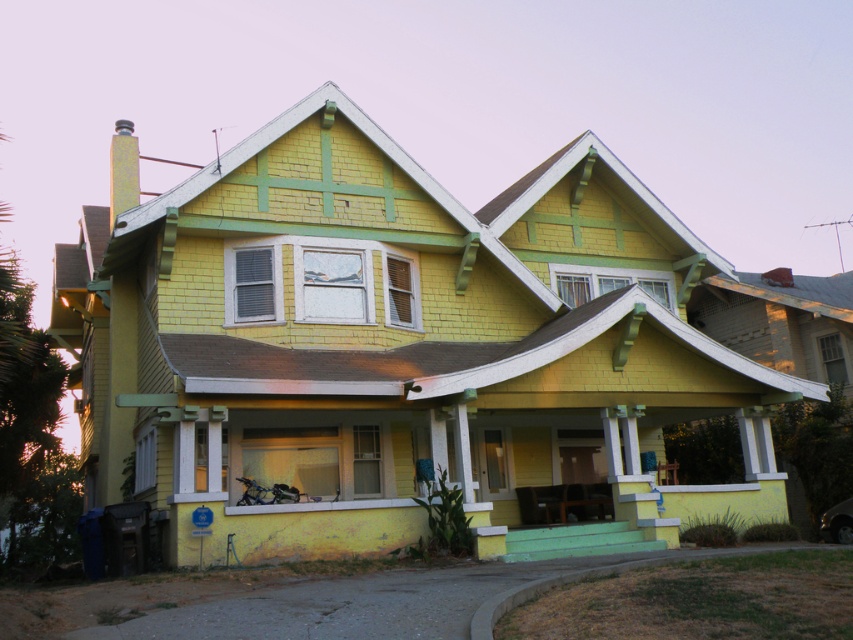
Is yellow shingles at center to the left of yellow painted wood porch at lower center from the viewer's perspective?

Yes, yellow shingles at center is to the left of yellow painted wood porch at lower center.

What do you see at coordinates (408, 348) in the screenshot? The image size is (853, 640). I see `yellow shingles at center` at bounding box center [408, 348].

I want to click on yellow shingles at center, so click(x=408, y=348).